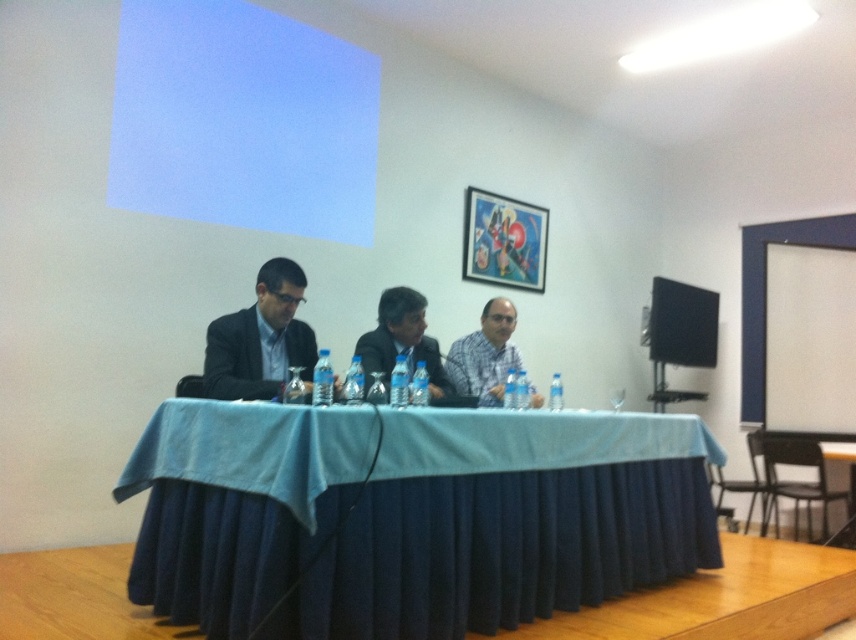
Is blue fabric table at center taller than black plastic speaker at right?

Yes, blue fabric table at center is taller than black plastic speaker at right.

At what (x,y) coordinates should I click in order to perform the action: click on blue fabric table at center. Please return your answer as a coordinate pair (x, y). Looking at the image, I should click on (508, 522).

What do you see at coordinates (508, 522) in the screenshot? I see `blue fabric table at center` at bounding box center [508, 522].

This screenshot has height=640, width=856. What are the coordinates of `blue fabric table at center` in the screenshot? It's located at (508, 522).

From the picture: Does black plastic speaker at right appear over white shirt at center?

Yes.

Between black plastic speaker at right and white shirt at center, which one is positioned higher?

black plastic speaker at right

What are the coordinates of `black plastic speaker at right` in the screenshot? It's located at (682, 324).

This screenshot has height=640, width=856. What are the coordinates of `black plastic speaker at right` in the screenshot? It's located at (682, 324).

How much distance is there between blue fabric table at center and white glossy projection screen at upper center?

blue fabric table at center is 6.94 feet from white glossy projection screen at upper center.

Can you confirm if blue fabric table at center is wider than white glossy projection screen at upper center?

Yes.

Does point (519, 429) come closer to viewer compared to point (276, 188)?

Yes, it is in front of point (276, 188).

Identify the location of blue fabric table at center. This screenshot has height=640, width=856. (508, 522).